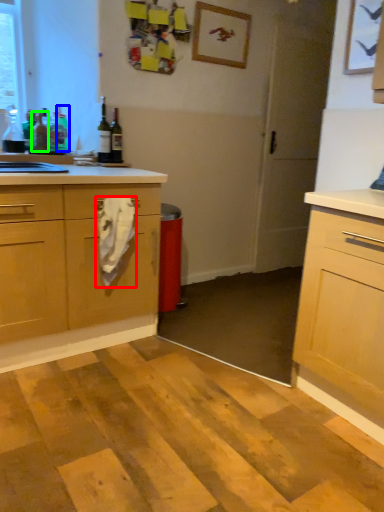
Question: Which object is positioned closest to material (highlighted by a red box)? Select from bottle (highlighted by a blue box) and bottle (highlighted by a green box).

Choices:
 (A) bottle
 (B) bottle

Answer: (B)